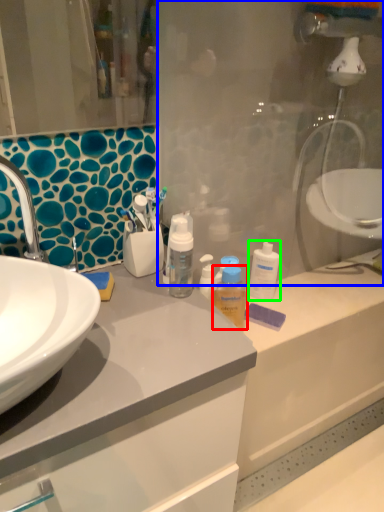
Question: Which object is the closest to the mouthwash (highlighted by a red box)? Choose among these: glass door (highlighted by a blue box) or cleaning product (highlighted by a green box).

Choices:
 (A) glass door
 (B) cleaning product

Answer: (B)